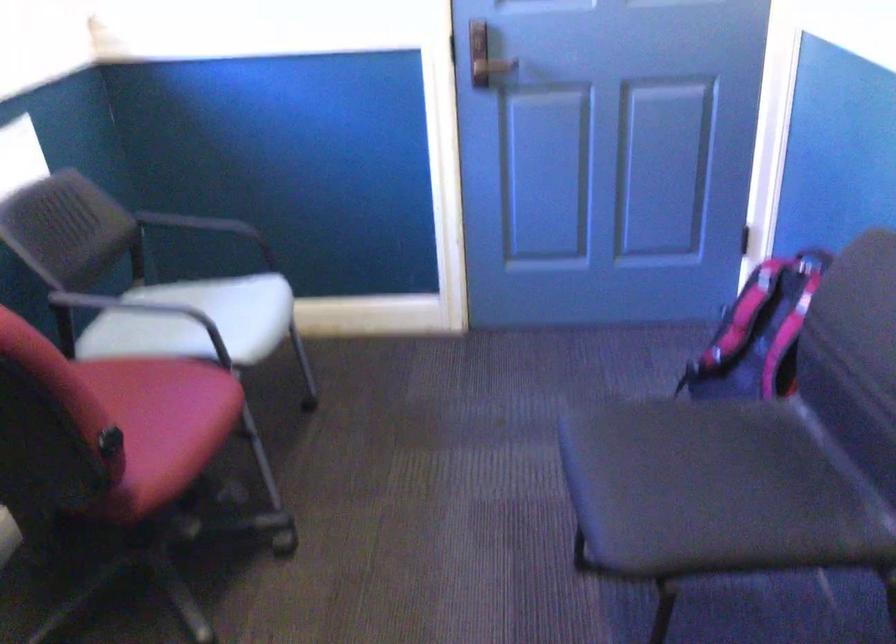
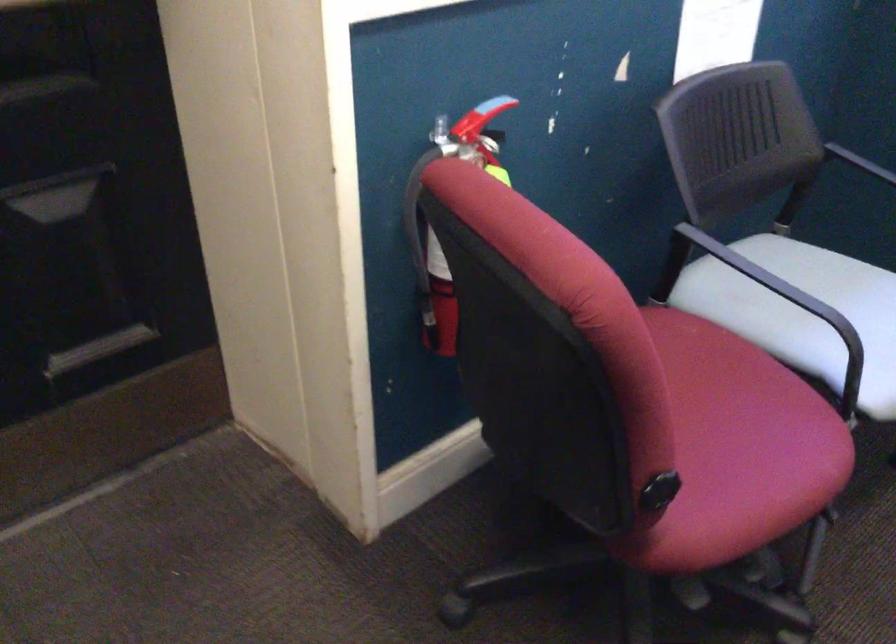
From the picture: How did the camera likely rotate?

The camera's rotation is toward left-down.